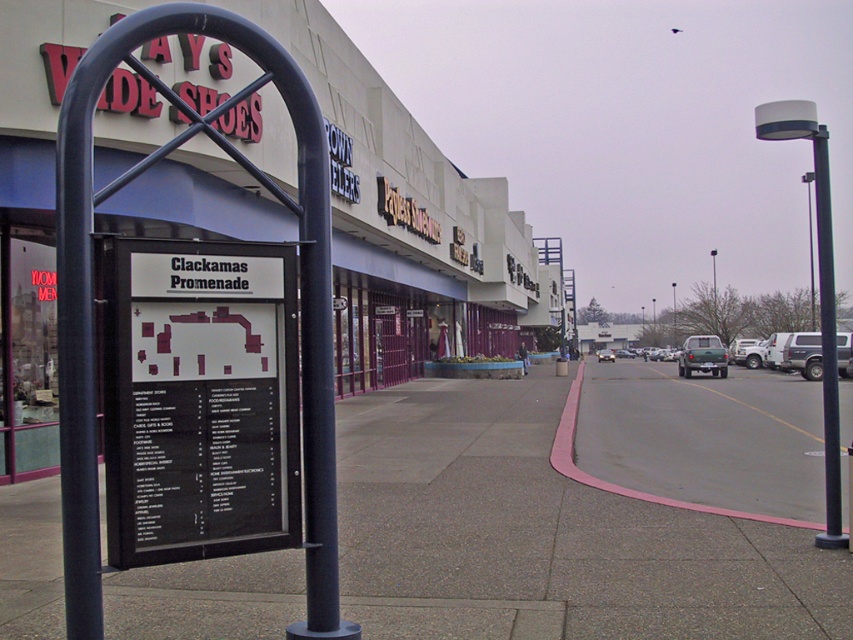
This screenshot has height=640, width=853. What do you see at coordinates (544, 532) in the screenshot?
I see `concrete sidewalk at center` at bounding box center [544, 532].

Who is positioned more to the right, concrete sidewalk at center or black metal sign at center?

Positioned to the right is black metal sign at center.

Who is more distant from viewer, (582, 544) or (4, 13)?

Point (4, 13)

This screenshot has height=640, width=853. What are the coordinates of `concrete sidewalk at center` in the screenshot? It's located at (544, 532).

Can you confirm if gray asphalt pavement at lower right is positioned to the left of silver metallic suv at right?

Correct, you'll find gray asphalt pavement at lower right to the left of silver metallic suv at right.

The width and height of the screenshot is (853, 640). I want to click on gray asphalt pavement at lower right, so click(x=704, y=436).

Where is `gray asphalt pavement at lower right`? The width and height of the screenshot is (853, 640). gray asphalt pavement at lower right is located at coordinates (704, 436).

Does concrete sidewalk at center have a greater width compared to gray asphalt pavement at lower right?

In fact, concrete sidewalk at center might be narrower than gray asphalt pavement at lower right.

Can you confirm if concrete sidewalk at center is thinner than gray asphalt pavement at lower right?

Correct, concrete sidewalk at center's width is less than gray asphalt pavement at lower right's.

Who is more distant from viewer, (653, 552) or (792, 426)?

The point (792, 426) is behind.

This screenshot has width=853, height=640. In order to click on concrete sidewalk at center in this screenshot , I will do 544,532.